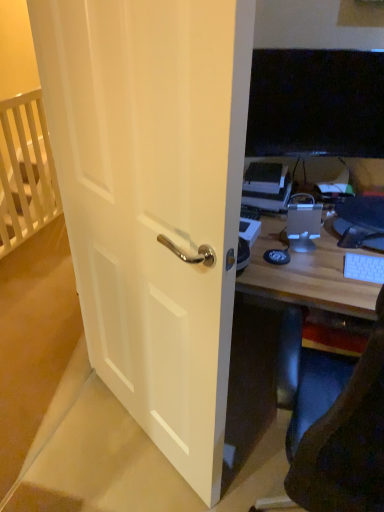
Where is `unoccupied region to the right of white wooden crib at upper left`? The height and width of the screenshot is (512, 384). unoccupied region to the right of white wooden crib at upper left is located at coordinates (51, 237).